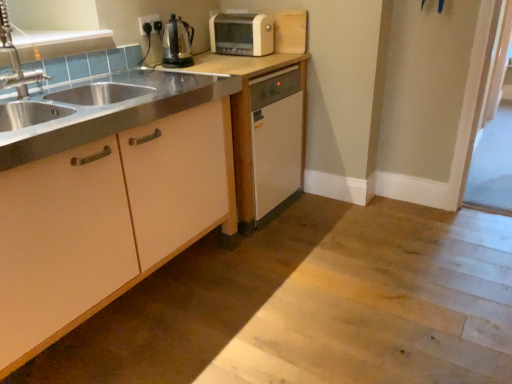
Question: Is matte white cabinet at left, placed as the 1th cabinetry when sorted from front to back, shorter than black plastic electric outlet at upper center?

Choices:
 (A) no
 (B) yes

Answer: (A)

Question: Does matte white cabinet at left, marked as the second cabinetry in a back-to-front arrangement, appear on the right side of black plastic electric outlet at upper center?

Choices:
 (A) yes
 (B) no

Answer: (B)

Question: Are matte white cabinet at left, marked as the second cabinetry in a back-to-front arrangement, and black plastic electric outlet at upper center located far from each other?

Choices:
 (A) yes
 (B) no

Answer: (A)

Question: Considering the relative sizes of matte white cabinet at left, placed as the 1th cabinetry when sorted from front to back, and black plastic electric outlet at upper center in the image provided, is matte white cabinet at left, placed as the 1th cabinetry when sorted from front to back, thinner than black plastic electric outlet at upper center?

Choices:
 (A) no
 (B) yes

Answer: (A)

Question: Can you confirm if matte white cabinet at left, placed as the 1th cabinetry when sorted from front to back, is bigger than black plastic electric outlet at upper center?

Choices:
 (A) yes
 (B) no

Answer: (A)

Question: Is brushed metal faucet at left in front of or behind matte white dishwasher at center, acting as the first cabinetry starting from the back, in the image?

Choices:
 (A) front
 (B) behind

Answer: (A)

Question: Considering the positions of brushed metal faucet at left and matte white dishwasher at center, acting as the first cabinetry starting from the back, in the image, is brushed metal faucet at left wider or thinner than matte white dishwasher at center, acting as the first cabinetry starting from the back,?

Choices:
 (A) thin
 (B) wide

Answer: (A)

Question: Is brushed metal faucet at left spatially inside matte white dishwasher at center, which is the second cabinetry in front-to-back order, or outside of it?

Choices:
 (A) outside
 (B) inside

Answer: (A)

Question: From the image's perspective, is brushed metal faucet at left located above or below matte white dishwasher at center, acting as the first cabinetry starting from the back?

Choices:
 (A) above
 (B) below

Answer: (A)

Question: In the image, is white plastic toaster at upper center on the left side or the right side of matte white dishwasher at center, which is the second cabinetry in front-to-back order?

Choices:
 (A) right
 (B) left

Answer: (A)

Question: Considering the positions of white plastic toaster at upper center and matte white dishwasher at center, acting as the first cabinetry starting from the back, in the image, is white plastic toaster at upper center taller or shorter than matte white dishwasher at center, acting as the first cabinetry starting from the back,?

Choices:
 (A) short
 (B) tall

Answer: (A)

Question: Based on their sizes in the image, would you say white plastic toaster at upper center is bigger or smaller than matte white dishwasher at center, acting as the first cabinetry starting from the back?

Choices:
 (A) big
 (B) small

Answer: (B)

Question: In the image, is white plastic toaster at upper center positioned in front of or behind matte white dishwasher at center, which is the second cabinetry in front-to-back order?

Choices:
 (A) front
 (B) behind

Answer: (B)

Question: In terms of width, does clear glass screen door at right look wider or thinner when compared to matte white cabinet at left, placed as the 1th cabinetry when sorted from front to back?

Choices:
 (A) wide
 (B) thin

Answer: (B)

Question: Visually, is clear glass screen door at right positioned to the left or to the right of matte white cabinet at left, placed as the 1th cabinetry when sorted from front to back?

Choices:
 (A) left
 (B) right

Answer: (B)